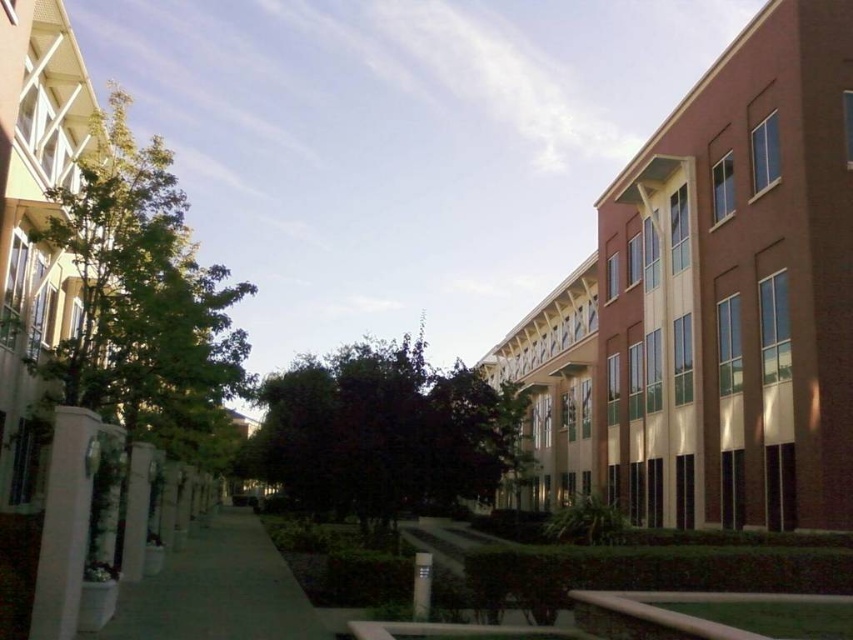
Question: Which object is the farthest from the dark green leafy tree at center?

Choices:
 (A) green leafy tree at left
 (B) green concrete sidewalk at center

Answer: (A)

Question: Is dark green leafy tree at center positioned behind green concrete sidewalk at center?

Choices:
 (A) yes
 (B) no

Answer: (A)

Question: Is green leafy tree at left wider than dark green leafy tree at center?

Choices:
 (A) no
 (B) yes

Answer: (B)

Question: In this image, where is dark green leafy tree at center located relative to green concrete sidewalk at center?

Choices:
 (A) right
 (B) left

Answer: (A)

Question: Among these objects, which one is nearest to the camera?

Choices:
 (A) dark green leafy tree at center
 (B) green concrete sidewalk at center
 (C) green leafy tree at left

Answer: (B)

Question: Which point is farther from the camera taking this photo?

Choices:
 (A) (112, 618)
 (B) (264, 467)

Answer: (B)